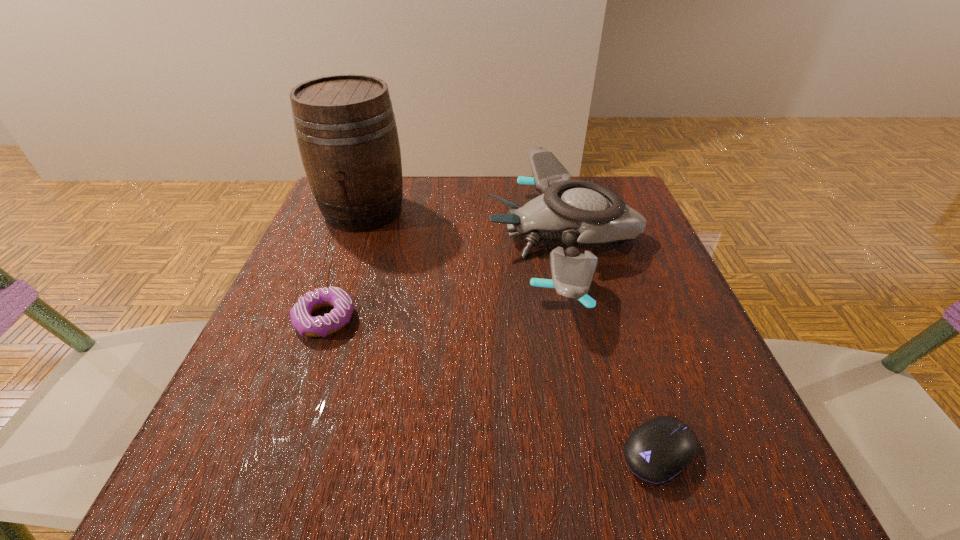
Where is `vacant space at the far edge of the desktop`? The image size is (960, 540). vacant space at the far edge of the desktop is located at coordinates coord(413,212).

I want to click on blank space at the near edge of the desktop, so click(514, 463).

Where is `free point at the left edge`? The image size is (960, 540). free point at the left edge is located at coordinates (238, 428).

I want to click on free region at the right edge, so click(654, 358).

Find the location of `vacant space at the far left corner of the desktop`. vacant space at the far left corner of the desktop is located at coordinates tap(317, 225).

Find the location of `vacant region at the far right corner`. vacant region at the far right corner is located at coordinates (631, 204).

Image resolution: width=960 pixels, height=540 pixels. What are the coordinates of `free location at the near right corner` in the screenshot? It's located at (661, 504).

This screenshot has width=960, height=540. I want to click on empty space between the computer mouse and the tallest object, so click(512, 332).

Where is `vacant space in between the doughnut and the nearest object`? Image resolution: width=960 pixels, height=540 pixels. vacant space in between the doughnut and the nearest object is located at coordinates (492, 386).

Locate an element on the screen. Image resolution: width=960 pixels, height=540 pixels. free space between the drone and the doughnut is located at coordinates (444, 279).